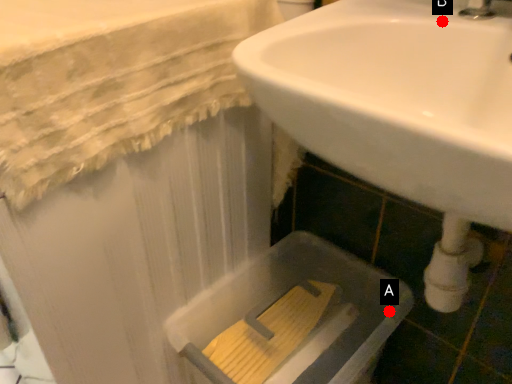
Question: Two points are circled on the image, labeled by A and B beside each circle. Which point appears farthest from the camera in this image?

Choices:
 (A) A is further
 (B) B is further

Answer: (A)